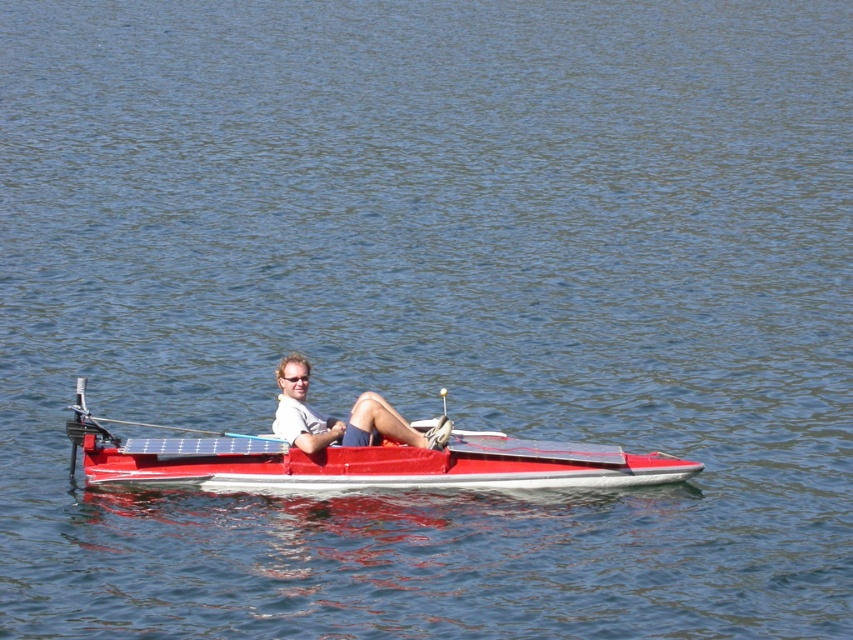
Between metallic red boat at center and blue plastic paddle at center, which one appears on the right side from the viewer's perspective?

metallic red boat at center is more to the right.

Is point (274, 461) closer to camera compared to point (241, 435)?

Yes.

This screenshot has height=640, width=853. What do you see at coordinates (357, 461) in the screenshot? I see `metallic red boat at center` at bounding box center [357, 461].

Where is `metallic red boat at center`? This screenshot has width=853, height=640. metallic red boat at center is located at coordinates (357, 461).

Who is positioned more to the right, metallic red boat at center or white matte shirt at center?

metallic red boat at center is more to the right.

Based on the photo, who is more forward, (219, 448) or (355, 442)?

Point (219, 448) is in front.

You are a GUI agent. You are given a task and a screenshot of the screen. Output one action in this format:
    pyautogui.click(x=<x>, y=<y>)
    Task: Click on the metallic red boat at center
    The height and width of the screenshot is (640, 853).
    Given the screenshot: What is the action you would take?
    pyautogui.click(x=357, y=461)

Between white matte shirt at center and blue plastic paddle at center, which one appears on the right side from the viewer's perspective?

Positioned to the right is white matte shirt at center.

Can you confirm if white matte shirt at center is bigger than blue plastic paddle at center?

Yes.

Which is in front, point (374, 397) or point (96, 420)?

Point (96, 420) is in front.

Where is `white matte shirt at center`? white matte shirt at center is located at coordinates (341, 420).